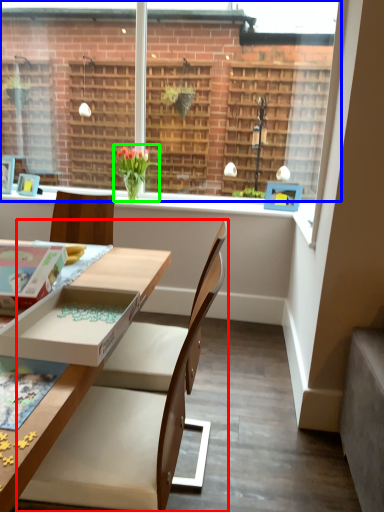
Question: Which object is the closest to the chair (highlighted by a red box)? Choose among these: window (highlighted by a blue box) or houseplant (highlighted by a green box).

Choices:
 (A) window
 (B) houseplant

Answer: (B)